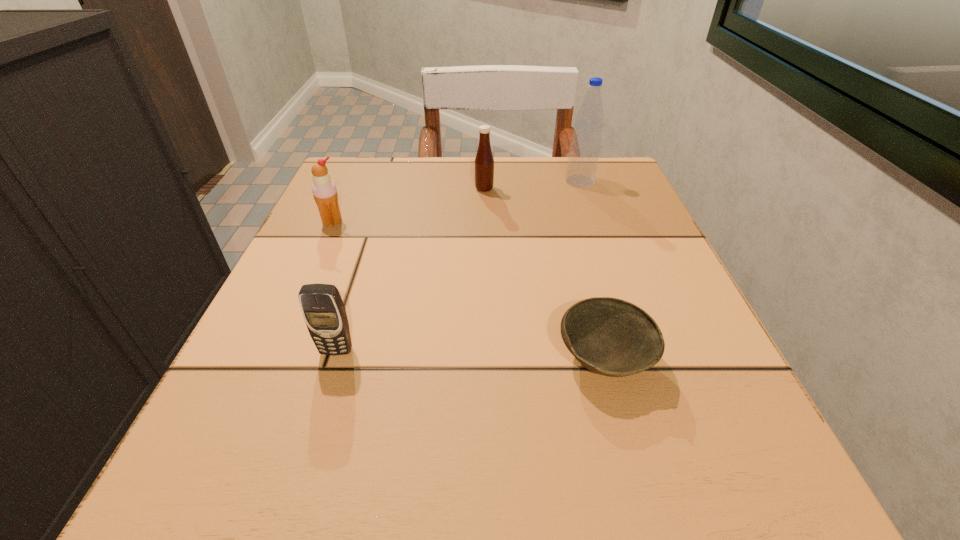
You are a GUI agent. You are given a task and a screenshot of the screen. Output one action in this format:
    pyautogui.click(x=<x>, y=<y>)
    Task: Click on the vacant space located on the back of the shortest object
    This screenshot has height=540, width=960.
    Given the screenshot: What is the action you would take?
    (575, 251)

Identify the location of water bottle positioned at the far edge. pos(585,147).

What are the coordinates of `Tabasco sauce that is positioned at the far edge` in the screenshot? It's located at (484, 162).

Locate an element on the screen. icecream that is at the left edge is located at coordinates (324, 190).

Find the location of a particular element. This screenshot has width=960, height=540. cellular telephone at the left edge is located at coordinates (324, 313).

Identify the location of water bottle that is at the right edge. (585, 147).

I want to click on bowl that is positioned at the right edge, so [611, 337].

At what (x,y) coordinates should I click in order to perform the action: click on object that is positioned at the far right corner. Please return your answer as a coordinate pair (x, y). This screenshot has width=960, height=540. Looking at the image, I should click on (585, 147).

Image resolution: width=960 pixels, height=540 pixels. I want to click on free spot at the far edge of the desktop, so click(533, 185).

In the image, there is a desktop. Where is `vacant space at the near edge`? The image size is (960, 540). vacant space at the near edge is located at coordinates (639, 511).